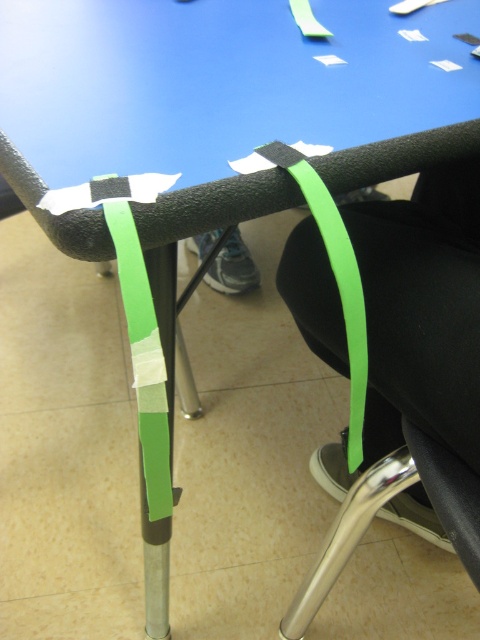
You are a delivery robot with a 12 inch wide package. You need to move from the point at the bottom left corner to the point at the bottom right corner of the room. The two points are marked as point (112, 227). Is there enough space for you to pass through?

The points are 15.51 inches apart, so yes, the robot can pass through since 15.51 inches is greater than the 12 inch width of the package.

You are positioning a new object on the chair armrest and need to place it exactly where the green matte strip at center is. What are the coordinates of the point where you should place it?

The coordinates for the green matte strip at center are at point (x=389, y=358).